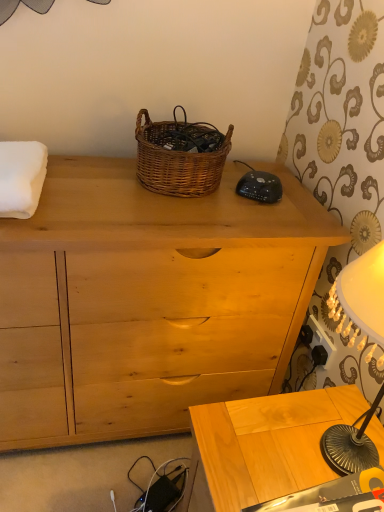
Where is `empty space that is ontop of light wood table at lower right`? The image size is (384, 512). empty space that is ontop of light wood table at lower right is located at coordinates (292, 439).